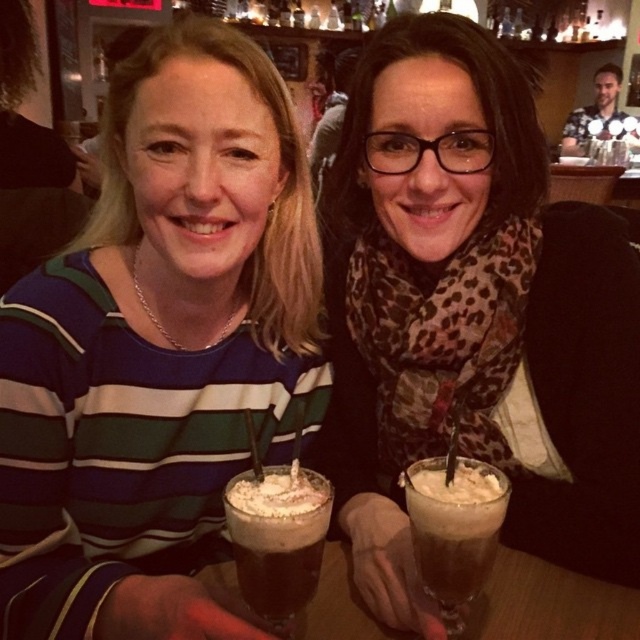
You are a barista trying to deliver a drink to the customer at the leopard print scarf at center. The frothy brown liquid at center is the drink. Can you slide the drink towards the customer without it spilling?

The leopard print scarf at center is further to the viewer than the frothy brown liquid at center, so sliding the drink towards the customer would require moving it away from you, which might risk spilling. Alternatively, you could hand it directly to them.

You are a barista observing two customers at the center of the image. You need to deliver a drink to the person wearing the green striped sweater at center. Which direction should you walk relative to the leopard print scarf at center?

The green striped sweater at center is located below the leopard print scarf at center, so you should walk downward from the leopard print scarf at center to reach the person wearing the green striped sweater at center.

You are standing in the bar and want to place a small tray between the two points, point (x=145, y=179) and point (x=465, y=464). Which point is closer to you so you can place the tray there first?

Point (x=145, y=179) is closer to you than point (x=465, y=464), so you can place the tray there first.